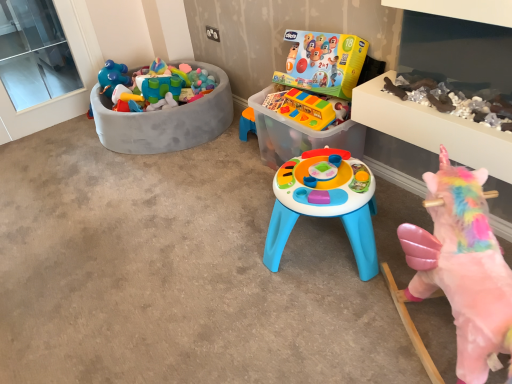
Image resolution: width=512 pixels, height=384 pixels. I want to click on pink fabric unicorn at lower right, placed as the fourth toy when sorted from back to front, so click(463, 267).

The height and width of the screenshot is (384, 512). Describe the element at coordinates (308, 108) in the screenshot. I see `rubberized yellow toy bus at center, the second toy positioned from the front` at that location.

Measure the distance between plastic toy bin at left, positioned as the first toy in back-to-front order, and camera.

A distance of 2.45 meters exists between plastic toy bin at left, positioned as the first toy in back-to-front order, and camera.

Identify the location of pink fabric unicorn at lower right, which ranks as the fourth toy in left-to-right order. (463, 267).

Is translucent plastic toy at center, arranged as the 2th toy when viewed from the back, inside rubberized yellow toy bus at center, placed as the third toy when sorted from back to front?

No.

Could you tell me if rubberized yellow toy bus at center, which appears as the third toy when viewed from the right, is facing translucent plastic toy at center, marked as the third toy in a left-to-right arrangement?

Yes, rubberized yellow toy bus at center, which appears as the third toy when viewed from the right, is aimed at translucent plastic toy at center, marked as the third toy in a left-to-right arrangement.

Does rubberized yellow toy bus at center, which appears as the third toy when viewed from the right, have a smaller size compared to translucent plastic toy at center, arranged as the 3th toy when viewed from the front?

Yes.

At what (x,y) coordinates should I click in order to perform the action: click on concrete on the left of rubberized yellow toy bus at center, which is counted as the 2th toy, starting from the left. Please return your answer as a coordinate pair (x, y). Looking at the image, I should click on (177, 273).

Is transparent plastic toy box at center taller than rubberized yellow toy bus at center, which is counted as the 2th toy, starting from the left?

Incorrect, the height of transparent plastic toy box at center is not larger of that of rubberized yellow toy bus at center, which is counted as the 2th toy, starting from the left.

From a real-world perspective, is transparent plastic toy box at center over rubberized yellow toy bus at center, which appears as the third toy when viewed from the right?

No, from a real-world perspective, transparent plastic toy box at center is not above rubberized yellow toy bus at center, which appears as the third toy when viewed from the right.

Can you confirm if transparent plastic toy box at center is smaller than rubberized yellow toy bus at center, placed as the third toy when sorted from back to front?

Actually, transparent plastic toy box at center might be larger than rubberized yellow toy bus at center, placed as the third toy when sorted from back to front.

Would you say translucent plastic toy at center, marked as the third toy in a left-to-right arrangement, contains transparent plastic toy box at center?

Definitely not — transparent plastic toy box at center is not inside translucent plastic toy at center, marked as the third toy in a left-to-right arrangement.

Which of these two, translucent plastic toy at center, marked as the third toy in a left-to-right arrangement, or transparent plastic toy box at center, is thinner?

translucent plastic toy at center, marked as the third toy in a left-to-right arrangement, is thinner.

Based on the photo, from their relative heights in the image, would you say translucent plastic toy at center, marked as the 2th toy in a right-to-left arrangement, is taller or shorter than transparent plastic toy box at center?

Considering their sizes, translucent plastic toy at center, marked as the 2th toy in a right-to-left arrangement, has more height than transparent plastic toy box at center.

Considering their positions, is translucent plastic toy at center, arranged as the 2th toy when viewed from the back, located in front of or behind transparent plastic toy box at center?

In the image, translucent plastic toy at center, arranged as the 2th toy when viewed from the back, appears behind transparent plastic toy box at center.

Is pink fabric unicorn at lower right, which ranks as the fourth toy in left-to-right order, wider than transparent glass window at upper left?

Yes.

Could you tell me if pink fabric unicorn at lower right, placed as the fourth toy when sorted from back to front, is turned towards transparent glass window at upper left?

No, pink fabric unicorn at lower right, placed as the fourth toy when sorted from back to front, is not facing towards transparent glass window at upper left.

Does pink fabric unicorn at lower right, which ranks as the fourth toy in left-to-right order, appear on the left side of transparent glass window at upper left?

In fact, pink fabric unicorn at lower right, which ranks as the fourth toy in left-to-right order, is to the right of transparent glass window at upper left.

Is the surface of pink fabric unicorn at lower right, the first toy from the right, in direct contact with transparent glass window at upper left?

There is a gap between pink fabric unicorn at lower right, the first toy from the right, and transparent glass window at upper left.

Is translucent plastic toy at center, marked as the third toy in a left-to-right arrangement, with pink fabric unicorn at lower right, which ranks as the fourth toy in left-to-right order?

translucent plastic toy at center, marked as the third toy in a left-to-right arrangement, and pink fabric unicorn at lower right, which ranks as the fourth toy in left-to-right order, are clearly separated.

Is translucent plastic toy at center, marked as the third toy in a left-to-right arrangement, positioned before pink fabric unicorn at lower right, which ranks as the fourth toy in left-to-right order?

No, translucent plastic toy at center, marked as the third toy in a left-to-right arrangement, is further to the viewer.

Does point (281, 157) come in front of point (498, 349)?

No.

Which object is wider, translucent plastic toy at center, arranged as the 3th toy when viewed from the front, or pink fabric unicorn at lower right, which appears as the first toy when viewed from the front?

Wider between the two is pink fabric unicorn at lower right, which appears as the first toy when viewed from the front.

Is transparent plastic toy box at center further to camera compared to transparent glass window at upper left?

No, it is in front of transparent glass window at upper left.

Are transparent plastic toy box at center and transparent glass window at upper left beside each other?

No, transparent plastic toy box at center is not in contact with transparent glass window at upper left.

Measure the distance between transparent plastic toy box at center and transparent glass window at upper left.

transparent plastic toy box at center is 1.68 meters from transparent glass window at upper left.

From a real-world perspective, which is physically above, transparent plastic toy box at center or transparent glass window at upper left?

transparent glass window at upper left.

Considering the sizes of objects rubberized yellow toy bus at center, which is counted as the 2th toy, starting from the left, and transparent glass window at upper left in the image provided, who is wider, rubberized yellow toy bus at center, which is counted as the 2th toy, starting from the left, or transparent glass window at upper left?

rubberized yellow toy bus at center, which is counted as the 2th toy, starting from the left, is wider.

Are rubberized yellow toy bus at center, the second toy positioned from the front, and transparent glass window at upper left far apart?

Yes.

In terms of height, does rubberized yellow toy bus at center, which appears as the third toy when viewed from the right, look taller or shorter compared to transparent glass window at upper left?

rubberized yellow toy bus at center, which appears as the third toy when viewed from the right, is shorter than transparent glass window at upper left.

Is rubberized yellow toy bus at center, which is counted as the 2th toy, starting from the left, inside the boundaries of transparent glass window at upper left, or outside?

rubberized yellow toy bus at center, which is counted as the 2th toy, starting from the left, is outside transparent glass window at upper left.

I want to click on the 1st toy below the rubberized yellow toy bus at center, which appears as the third toy when viewed from the right (from the image's perspective), so click(x=323, y=63).

You are a GUI agent. You are given a task and a screenshot of the screen. Output one action in this format:
    pyautogui.click(x=<x>, y=<y>)
    Task: Click on the concrete located on the left of rubberized yellow toy bus at center, which is counted as the 2th toy, starting from the left
    This screenshot has height=384, width=512.
    Given the screenshot: What is the action you would take?
    pyautogui.click(x=177, y=273)

From the image, which object appears to be farther from pink fabric unicorn at lower right, which ranks as the fourth toy in left-to-right order, transparent glass window at upper left or transparent plastic toy box at center?

Among the two, transparent glass window at upper left is located further to pink fabric unicorn at lower right, which ranks as the fourth toy in left-to-right order.

When comparing their distances from translucent plastic toy at center, marked as the third toy in a left-to-right arrangement, does rubberized yellow toy bus at center, the second toy positioned from the front, or transparent glass window at upper left seem further?

Among the two, transparent glass window at upper left is located further to translucent plastic toy at center, marked as the third toy in a left-to-right arrangement.

From the image, which object appears to be nearer to pink fabric unicorn at lower right, which appears as the first toy when viewed from the front, transparent glass window at upper left or rubberized yellow toy bus at center, the second toy positioned from the front?

rubberized yellow toy bus at center, the second toy positioned from the front, is positioned closer to the anchor pink fabric unicorn at lower right, which appears as the first toy when viewed from the front.

Estimate the real-world distances between objects in this image. Which object is further from rubberized yellow toy bus at center, which is counted as the 2th toy, starting from the left, transparent plastic toy box at center or transparent glass window at upper left?

transparent glass window at upper left is positioned further to the anchor rubberized yellow toy bus at center, which is counted as the 2th toy, starting from the left.

Based on their spatial positions, is rubberized yellow toy bus at center, which is counted as the 2th toy, starting from the left, or translucent plastic toy at center, arranged as the 3th toy when viewed from the front, further from pink fabric unicorn at lower right, placed as the fourth toy when sorted from back to front?

translucent plastic toy at center, arranged as the 3th toy when viewed from the front, is positioned further to the anchor pink fabric unicorn at lower right, placed as the fourth toy when sorted from back to front.

Looking at the image, which one is located further to transparent plastic toy box at center, translucent plastic toy at center, arranged as the 3th toy when viewed from the front, or transparent glass window at upper left?

The object further to transparent plastic toy box at center is transparent glass window at upper left.

From the image, which object appears to be farther from transparent plastic toy box at center, pink fabric unicorn at lower right, placed as the fourth toy when sorted from back to front, or translucent plastic toy at center, marked as the 2th toy in a right-to-left arrangement?

pink fabric unicorn at lower right, placed as the fourth toy when sorted from back to front, is further to transparent plastic toy box at center.

When comparing their distances from plastic toy bin at left, the fourth toy in the right-to-left sequence, does transparent plastic toy box at center or transparent glass window at upper left seem further?

transparent glass window at upper left is further to plastic toy bin at left, the fourth toy in the right-to-left sequence.

The height and width of the screenshot is (384, 512). I want to click on toy located between plastic toy bin at left, the fourth toy in the right-to-left sequence, and translucent plastic toy at center, arranged as the 3th toy when viewed from the front, in the left-right direction, so click(308, 108).

You are a GUI agent. You are given a task and a screenshot of the screen. Output one action in this format:
    pyautogui.click(x=<x>, y=<y>)
    Task: Click on the concrete between transparent glass window at upper left and rubberized yellow toy bus at center, the second toy positioned from the front, from left to right
    Image resolution: width=512 pixels, height=384 pixels.
    Given the screenshot: What is the action you would take?
    pyautogui.click(x=177, y=273)

Locate an element on the screen. Image resolution: width=512 pixels, height=384 pixels. toy positioned between transparent plastic toy box at center and rubberized yellow toy bus at center, which is counted as the 2th toy, starting from the left, from near to far is located at coordinates [x=463, y=267].

At what (x,y) coordinates should I click in order to perform the action: click on concrete between transparent glass window at upper left and pink fabric unicorn at lower right, which appears as the first toy when viewed from the front, from left to right. Please return your answer as a coordinate pair (x, y). This screenshot has width=512, height=384. Looking at the image, I should click on (177, 273).